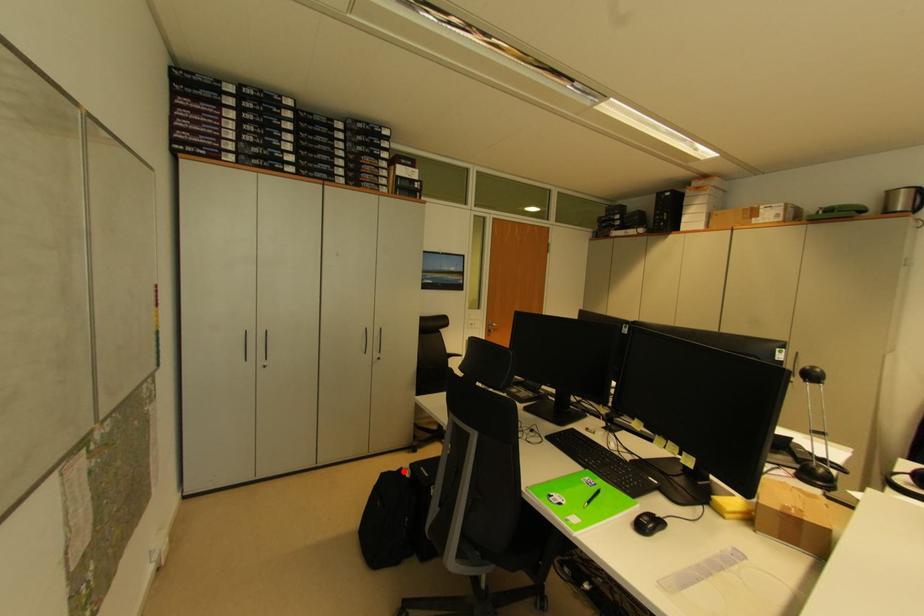
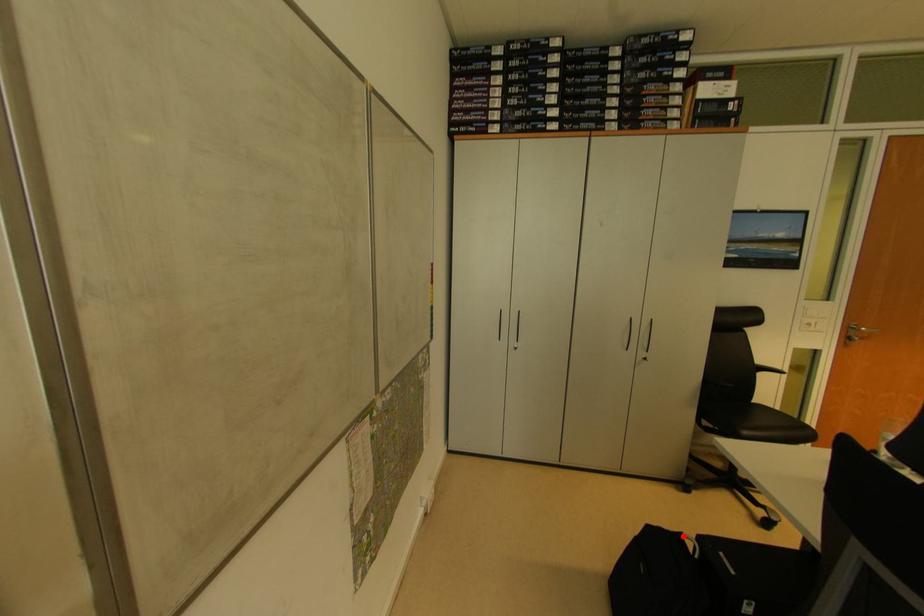
I am providing you with two images of the same scene from different viewpoints. A red point is marked on the first image and another point is marked on the second image. Is the red point in image1 aligned with the point shown in image2?

Yes